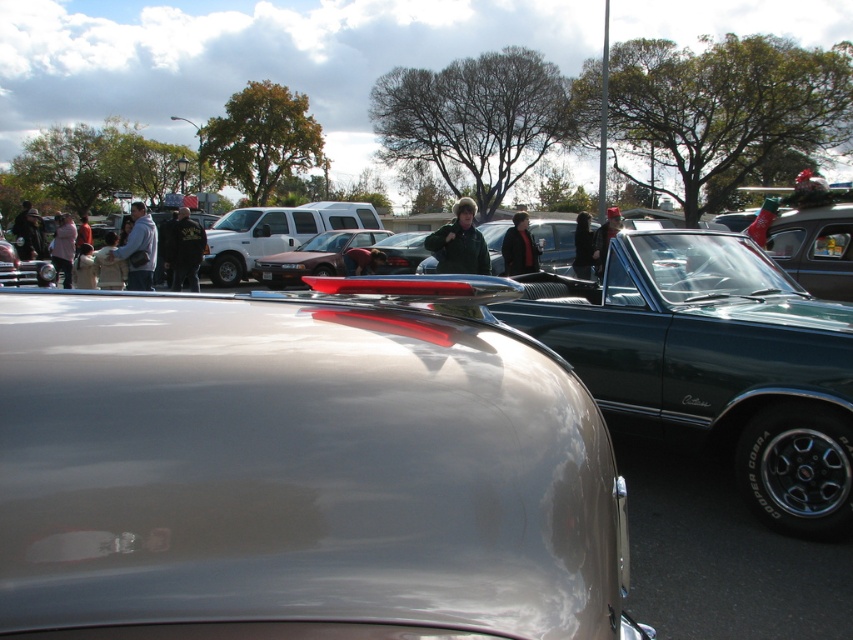
You are a photographer trying to capture a clear photo of the matte red car at center and the dark brown leather jacket at center. However, you notice that the jacket is blocking part of the car. Which object should you move to get an unobstructed view of the car?

The dark brown leather jacket at center is behind the matte red car at center, so you should move the dark brown leather jacket at center to get an unobstructed view of the matte red car at center.

You are a photographer at the car show and want to capture both the matte red car at center and the dark brown leather jacket at center in a single shot. Based on their positions, can you include both in your photo without moving the camera?

The matte red car at center is located below the dark brown leather jacket at center, so yes, you can include both in your photo without moving the camera as they are vertically aligned.